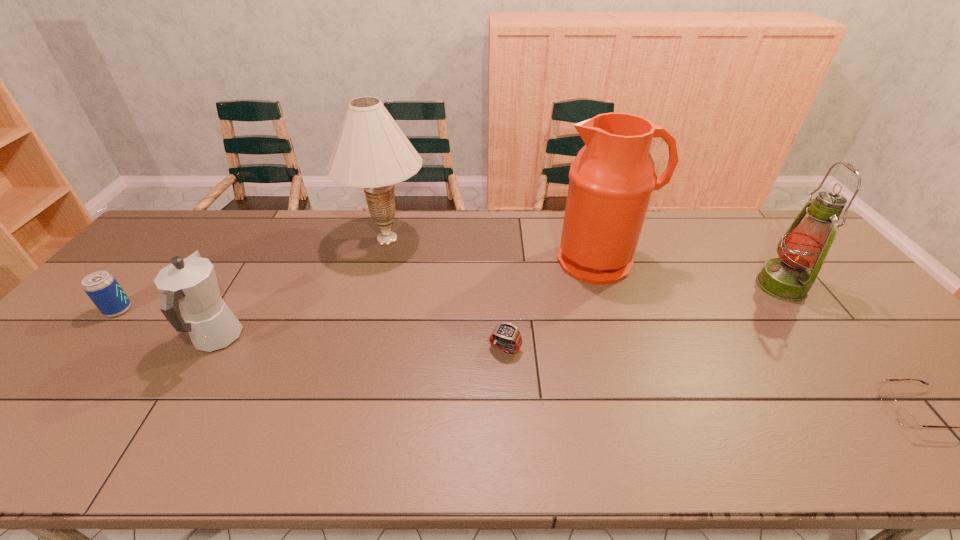
Where is `vacant area that lies between the fifth object from left to right and the oil lamp`? The image size is (960, 540). vacant area that lies between the fifth object from left to right and the oil lamp is located at coordinates tap(691, 274).

Choose which object is the nearest neighbor to the sixth object from right to left. Please provide its 2D coordinates. Your answer should be formatted as a tuple, i.e. [(x, y)], where the tuple contains the x and y coordinates of a point satisfying the conditions above.

[(102, 288)]

You are a GUI agent. You are given a task and a screenshot of the screen. Output one action in this format:
    pyautogui.click(x=<x>, y=<y>)
    Task: Click on the closest object to the oil lamp
    
    Given the screenshot: What is the action you would take?
    pyautogui.click(x=904, y=417)

The image size is (960, 540). What are the coordinates of `vacant area that satisfies the following two spatial constraints: 1. on the front side of the leftmost object; 2. on the right side of the sixth object from right to left` in the screenshot? It's located at tap(94, 339).